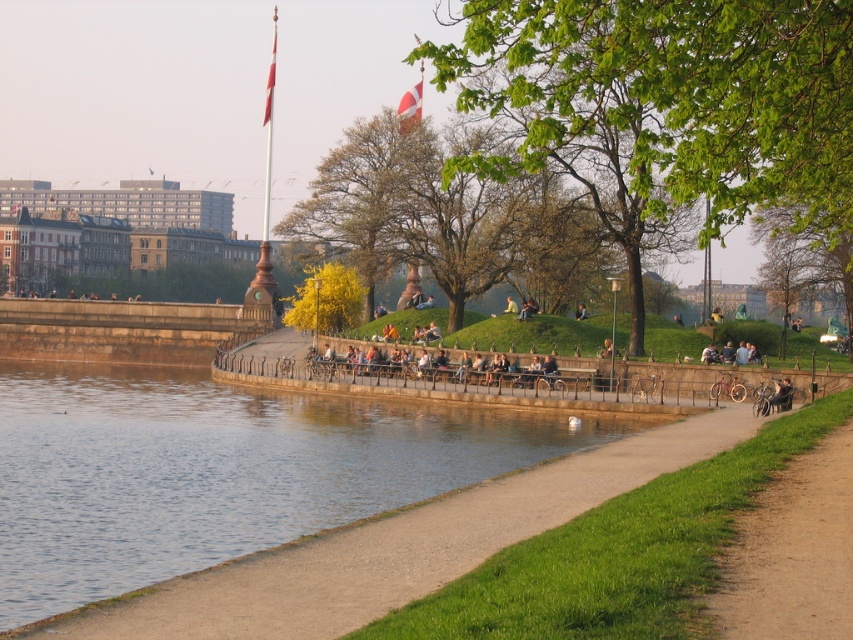
Question: Which of the following is the farthest from the observer?

Choices:
 (A) brown dirt path at lower right
 (B) clear water at lower left

Answer: (B)

Question: Does clear water at lower left have a larger size compared to brown dirt path at lower right?

Choices:
 (A) yes
 (B) no

Answer: (A)

Question: Can you confirm if clear water at lower left is positioned to the right of brown dirt path at lower right?

Choices:
 (A) yes
 (B) no

Answer: (B)

Question: Among these points, which one is nearest to the camera?

Choices:
 (A) (833, 481)
 (B) (399, 420)

Answer: (A)

Question: Does clear water at lower left appear over brown dirt path at lower right?

Choices:
 (A) no
 (B) yes

Answer: (A)